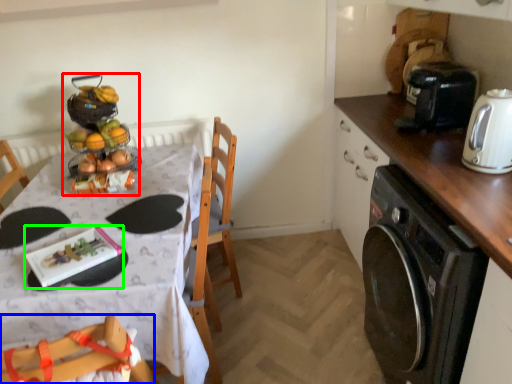
Question: Based on their relative distances, which object is farther from food (highlighted by a red box)? Choose from chair (highlighted by a blue box) and tableware (highlighted by a green box).

Choices:
 (A) chair
 (B) tableware

Answer: (A)